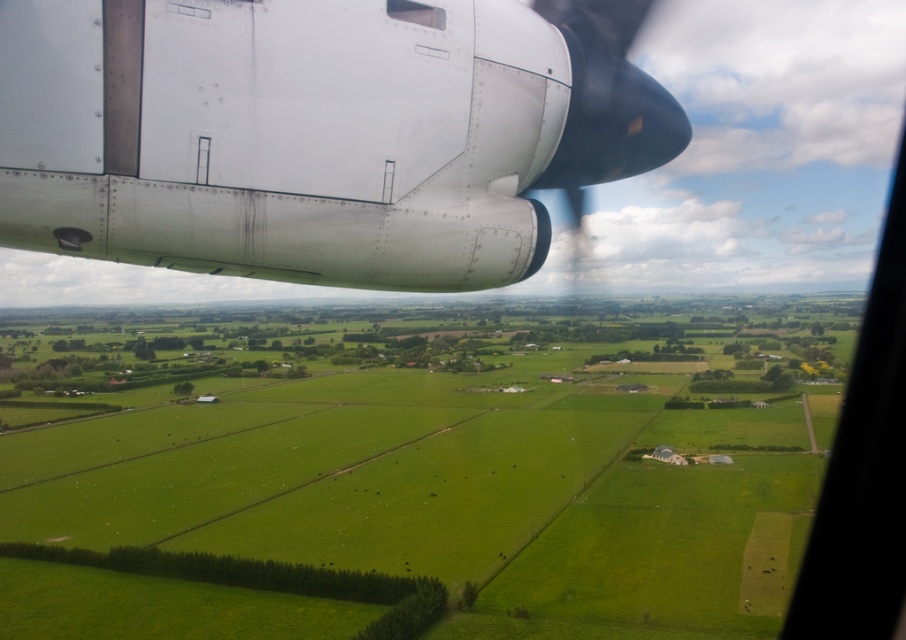
Between green grassland at center and polished metallic propeller at upper right, which one has more height?

With more height is green grassland at center.

Is point (548, 561) behind point (648, 150)?

Yes, point (548, 561) is farther from viewer.

Locate an element on the screen. green grassland at center is located at coordinates (460, 484).

Is point (336, 106) positioned in front of point (441, 29)?

Yes, it is.

The image size is (906, 640). I want to click on metallic silver airplane engine at upper left, so [x=316, y=132].

Measure the distance between point (359, 168) and camera.

Point (359, 168) and camera are 11.97 feet apart.

This screenshot has width=906, height=640. I want to click on metallic silver airplane engine at upper left, so click(316, 132).

Is polished metallic propeller at upper right smaller than transparent plastic airplane window at upper center?

Actually, polished metallic propeller at upper right might be larger than transparent plastic airplane window at upper center.

Is polished metallic propeller at upper right taller than transparent plastic airplane window at upper center?

Correct, polished metallic propeller at upper right is much taller as transparent plastic airplane window at upper center.

Between point (577, 99) and point (419, 3), which one is positioned behind?

Point (577, 99)

Find the location of a particular element. polished metallic propeller at upper right is located at coordinates (606, 106).